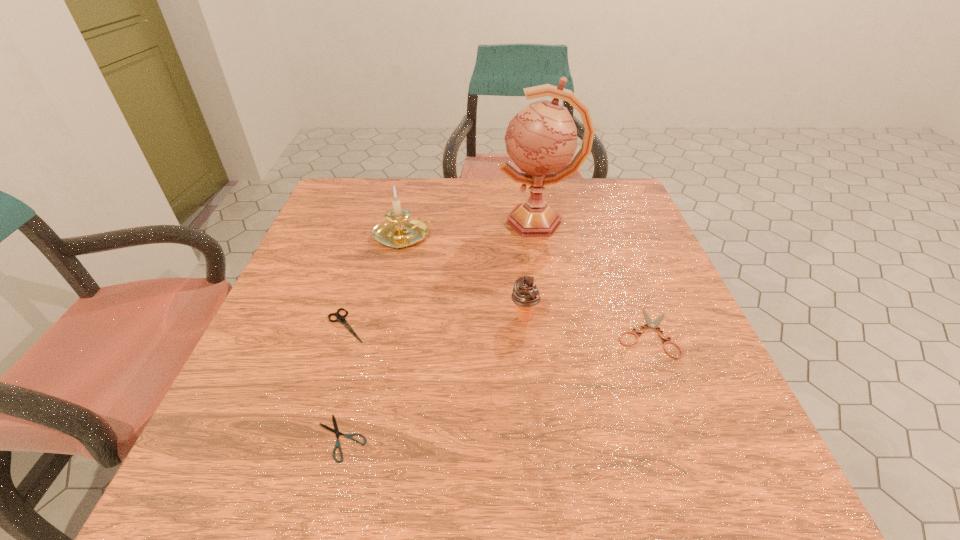
Locate an element on the screen. free space between the tallest shears and the rightmost shears is located at coordinates (495, 329).

Where is `free spot between the tallest shears and the candle holder`? The image size is (960, 540). free spot between the tallest shears and the candle holder is located at coordinates (375, 281).

At what (x,y) coordinates should I click in order to perform the action: click on vacant space that is in between the tallest object and the icecream. Please return your answer as a coordinate pair (x, y). Looking at the image, I should click on (531, 270).

Find the location of `unoccupied position between the tallest object and the third tallest object`. unoccupied position between the tallest object and the third tallest object is located at coordinates (531, 270).

You are a GUI agent. You are given a task and a screenshot of the screen. Output one action in this format:
    pyautogui.click(x=<x>, y=<y>)
    Task: Click on the free space between the fourth shortest object and the fifth tallest object
    
    Given the screenshot: What is the action you would take?
    pyautogui.click(x=585, y=325)

Where is `vacant area between the third shortest object and the third tallest object`? The width and height of the screenshot is (960, 540). vacant area between the third shortest object and the third tallest object is located at coordinates (435, 322).

The height and width of the screenshot is (540, 960). In order to click on object that is the closest to the globe in this screenshot , I will do `click(397, 231)`.

Locate which object is the fourth closest to the nearest shears. Please provide its 2D coordinates. Your answer should be formatted as a tuple, i.e. [(x, y)], where the tuple contains the x and y coordinates of a point satisfying the conditions above.

[(654, 324)]

Locate an element on the screen. The height and width of the screenshot is (540, 960). shears that is the second closest to the tallest object is located at coordinates (340, 318).

Identify which shears is the closest to the rightmost object. Please provide its 2D coordinates. Your answer should be formatted as a tuple, i.e. [(x, y)], where the tuple contains the x and y coordinates of a point satisfying the conditions above.

[(336, 431)]